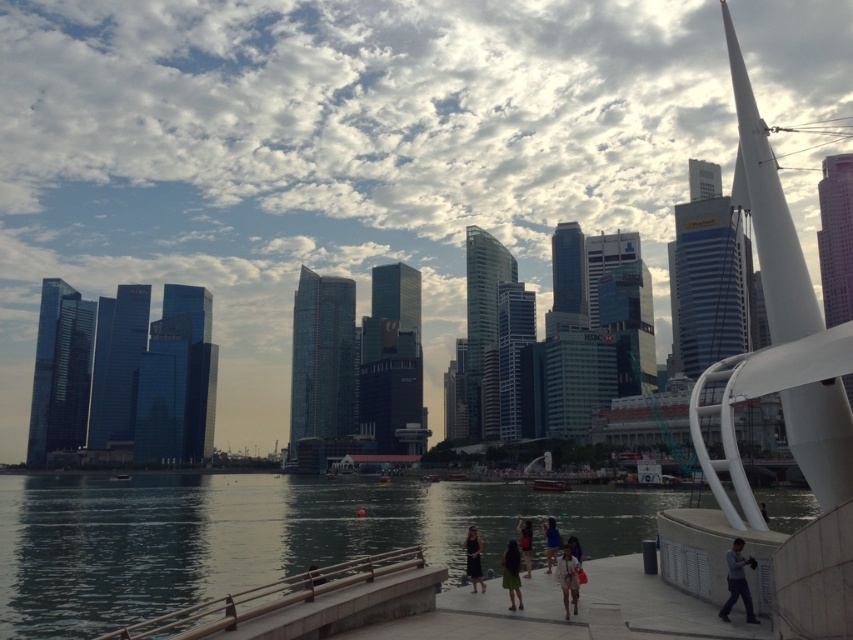
You are standing at the center of the walkway in the waterfront scene. You see a gray fabric jacket at lower right. Where is the gray fabric jacket located relative to your position?

The gray fabric jacket at lower right is located at point (737, 580) relative to your position.

You are standing at the edge of the walkway and want to determine which of the two points, point 1 at coordinates point (737, 579) or point 2 at coordinates point (572, 566), is closer to you. Based on the scene description, which point is nearer?

Point (737, 579) is closer to the viewer than point (572, 566).